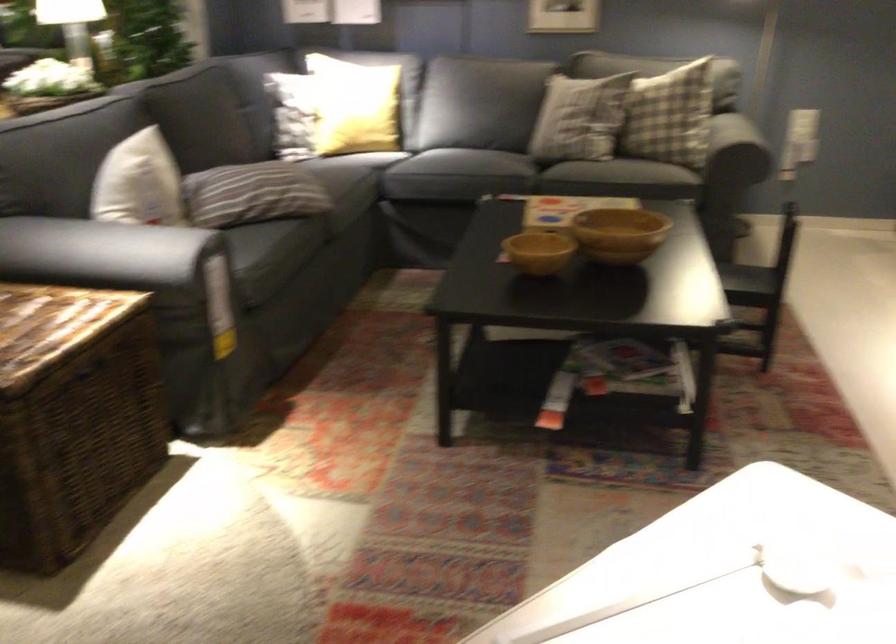
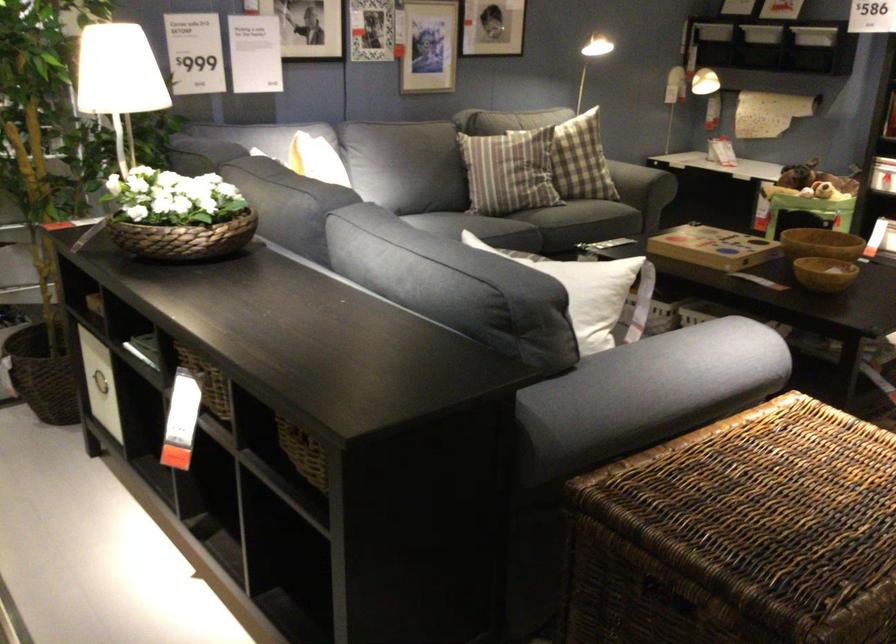
Question: I am providing you with two images of the same scene from different viewpoints. Which of the following objects are not visible in image2?

Choices:
 (A) red can nozzle
 (B) dark sofa sitting surface
 (C) wooden bowl
 (D) sofa sitting surface

Answer: (B)